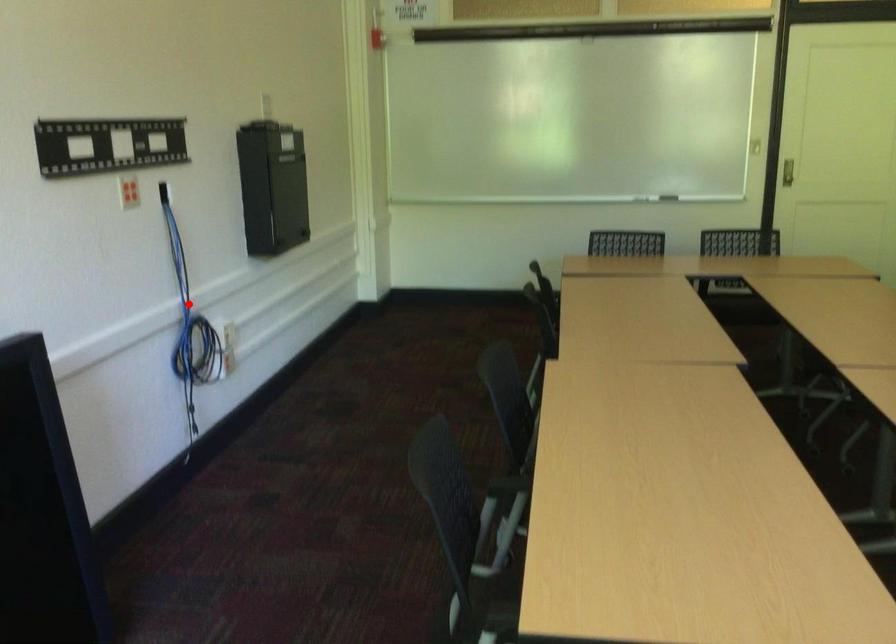
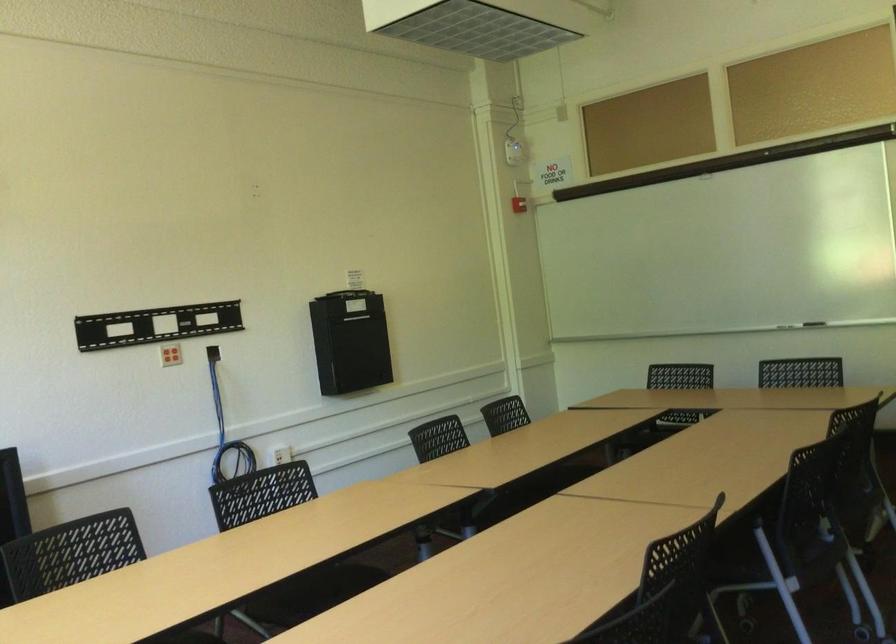
Find the pixel in the second image that matches the highlighted location in the first image.

(226, 431)